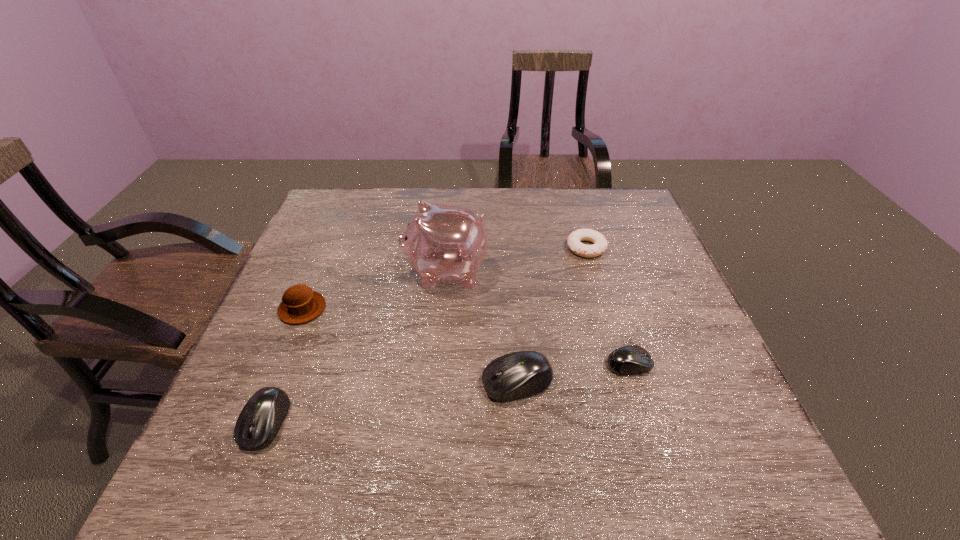
Where is `free space at the far edge of the desktop`? free space at the far edge of the desktop is located at coordinates (379, 223).

Where is `vacant space at the near edge`? The width and height of the screenshot is (960, 540). vacant space at the near edge is located at coordinates (559, 414).

Find the location of a particular element. The width and height of the screenshot is (960, 540). vacant space at the left edge is located at coordinates (322, 237).

You are a GUI agent. You are given a task and a screenshot of the screen. Output one action in this format:
    pyautogui.click(x=<x>, y=<y>)
    Task: Click on the free space at the right edge of the desktop
    Image resolution: width=960 pixels, height=540 pixels.
    Given the screenshot: What is the action you would take?
    pyautogui.click(x=679, y=335)

This screenshot has width=960, height=540. Identify the location of free region at the far left corner of the desktop. (369, 193).

At what (x,y) coordinates should I click in order to perform the action: click on vacant space in between the muffin and the second mouse from left to right. Please return your answer as a coordinate pair (x, y). Looking at the image, I should click on (410, 346).

Locate an element on the screen. free space that is in between the rightmost mouse and the second mouse from right to left is located at coordinates (573, 374).

This screenshot has height=540, width=960. In order to click on free space between the leftmost mouse and the piggy bank in this screenshot , I will do `click(356, 347)`.

At what (x,y) coordinates should I click in order to perform the action: click on free space between the tallest mouse and the piggy bank. Please return your answer as a coordinate pair (x, y). The image size is (960, 540). Looking at the image, I should click on (481, 327).

Image resolution: width=960 pixels, height=540 pixels. Find the location of `free space between the muffin and the rightmost mouse`. free space between the muffin and the rightmost mouse is located at coordinates (466, 336).